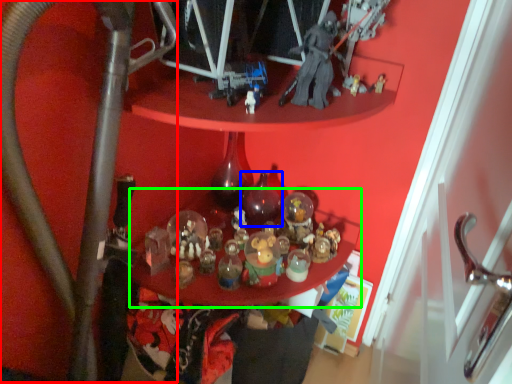
Question: Which object is the farthest from water pipe (highlighted by a red box)? Choose among these: bottle (highlighted by a blue box) or table (highlighted by a green box).

Choices:
 (A) bottle
 (B) table

Answer: (A)